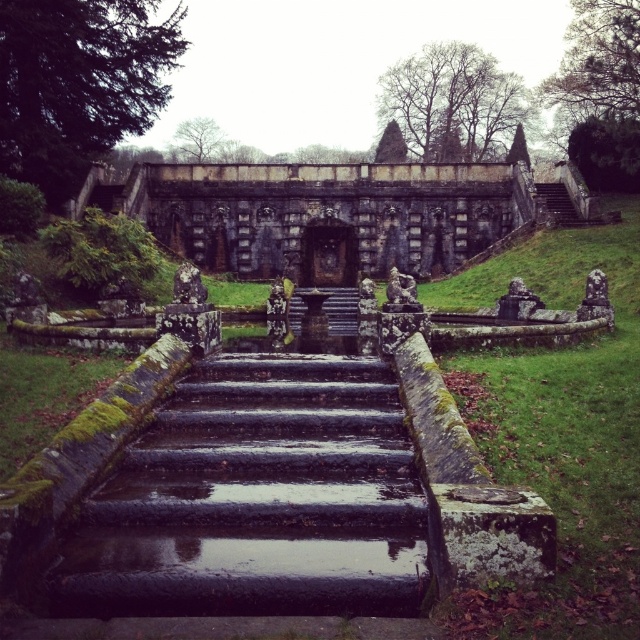
Question: Is rustic stone statue at upper right wider than rustic stone statue at center?

Choices:
 (A) no
 (B) yes

Answer: (A)

Question: Considering the real-world distances, which object is closest to the black stone statue at center?

Choices:
 (A) slate gray stone lion at center
 (B) rustic stone statue at center
 (C) rustic stone statue at upper right
 (D) mossy stone stairs at center

Answer: (B)

Question: Can you confirm if green stone statue at center is wider than rustic stone statue at center?

Choices:
 (A) no
 (B) yes

Answer: (B)

Question: Can you confirm if mossy stone stairs at center is positioned below rustic stone statue at center?

Choices:
 (A) no
 (B) yes

Answer: (B)

Question: Which object is farther from the camera taking this photo?

Choices:
 (A) green stone statue at center
 (B) rustic stone statue at upper right
 (C) slate gray stone lion at center

Answer: (C)

Question: Which of the following is the farthest from the observer?

Choices:
 (A) tap(362, 304)
 (B) tap(163, 572)

Answer: (A)